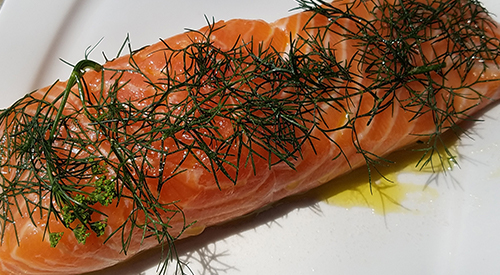
Locate an element on the screen. This screenshot has width=500, height=275. plate is located at coordinates (46, 30).